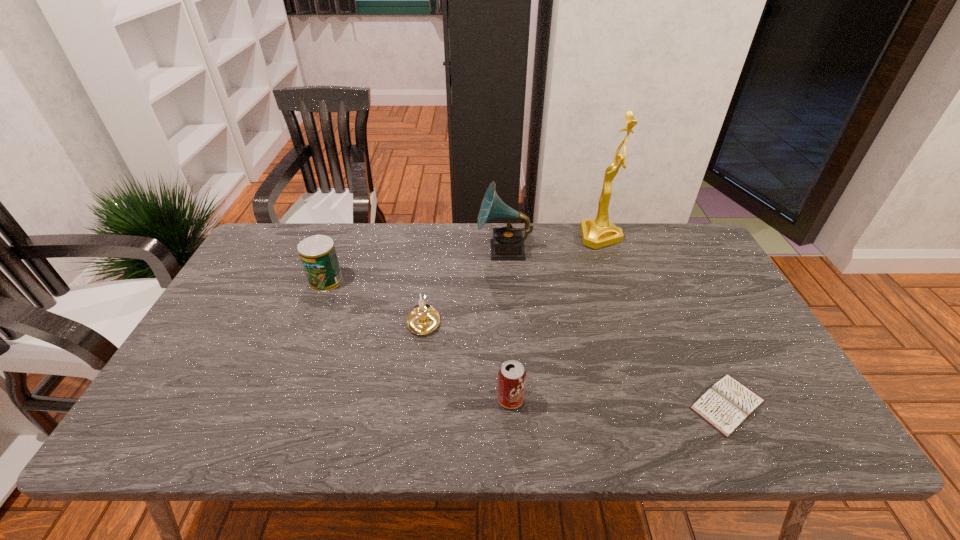
Identify the location of award. Image resolution: width=960 pixels, height=540 pixels. (599, 232).

Locate an element on the screen. The height and width of the screenshot is (540, 960). phonograph_record is located at coordinates (508, 243).

Locate an element on the screen. Image resolution: width=960 pixels, height=540 pixels. the fourth shortest object is located at coordinates tap(318, 255).

What are the coordinates of `the third farthest object` in the screenshot? It's located at (318, 255).

Where is `soda can`? The width and height of the screenshot is (960, 540). soda can is located at coordinates (511, 376).

I want to click on the fifth object from right to left, so (423, 319).

I want to click on the fourth farthest object, so click(423, 319).

At what (x,y) coordinates should I click in order to perform the action: click on diary. Please return your answer as a coordinate pair (x, y). The image size is (960, 540). Looking at the image, I should click on (727, 404).

Locate an element on the screen. blank space located on the front-facing side of the tallest object is located at coordinates (465, 237).

Identify the location of vacant point located on the front-facing side of the tallest object. (500, 237).